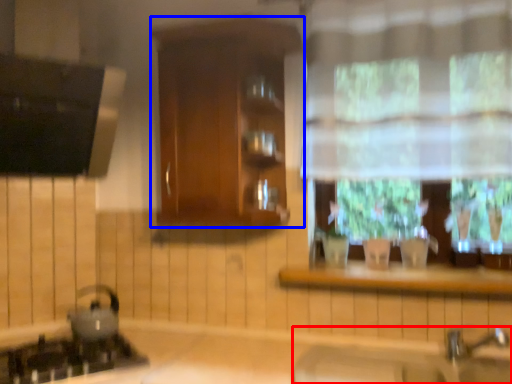
Question: Which of the following is the closest to the observer, sink (highlighted by a red box) or cabinetry (highlighted by a blue box)?

Choices:
 (A) sink
 (B) cabinetry

Answer: (A)